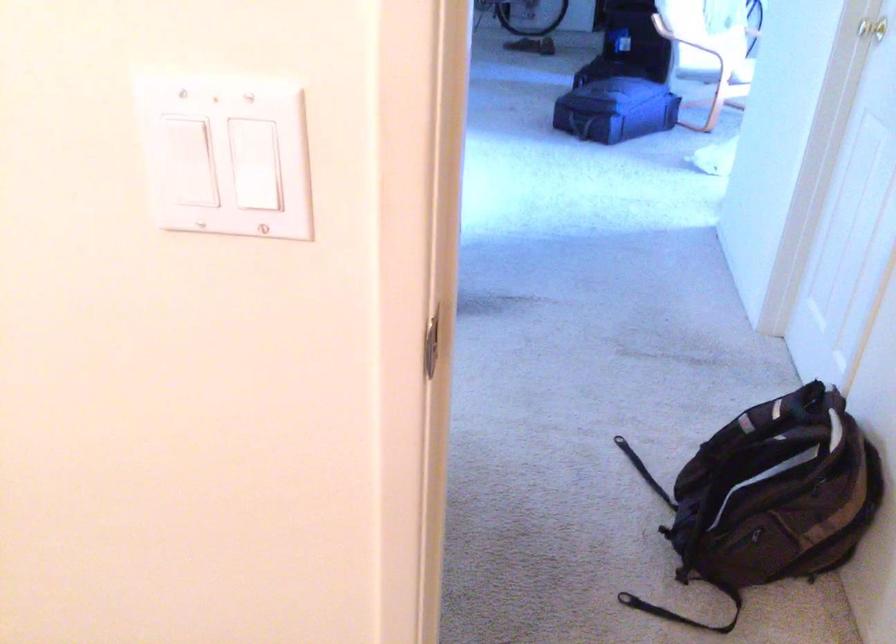
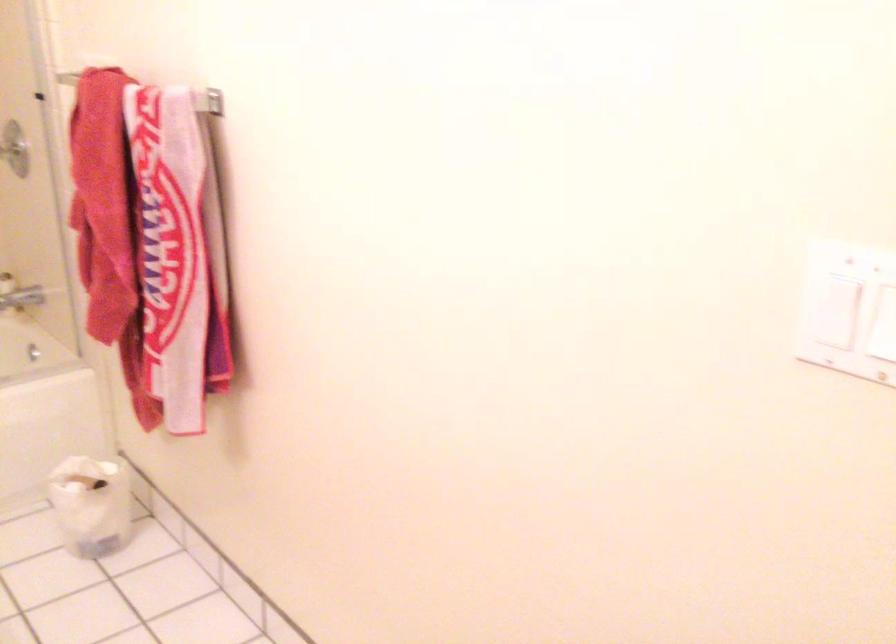
Question: The camera is either moving clockwise (left) or counter-clockwise (right) around the object. The first image is from the beginning of the video and the second image is from the end. Is the camera moving left or right when shooting the video?

Choices:
 (A) Left
 (B) Right

Answer: (B)